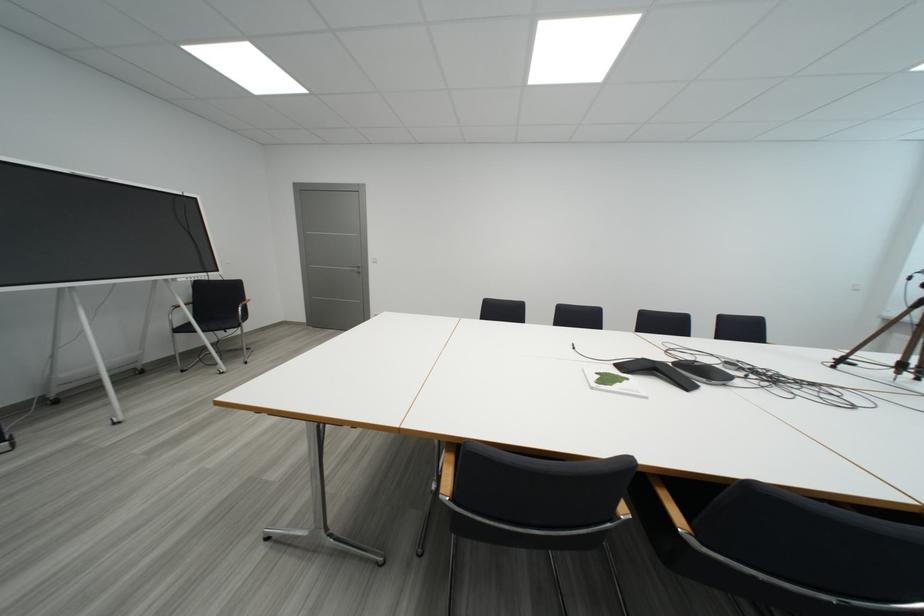
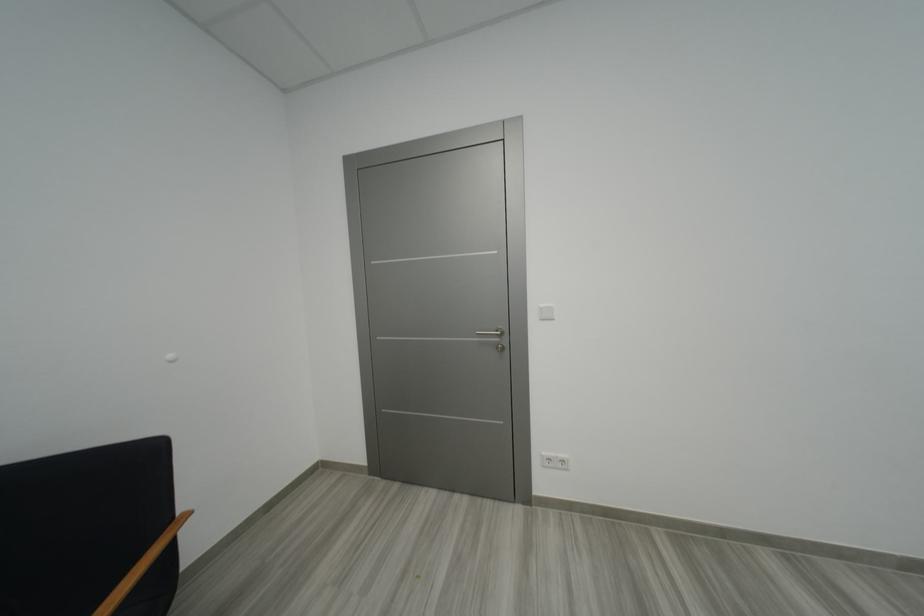
In a continuous first-person perspective shot, in which direction is the camera moving?

The movement direction of the cameraman is left, forward.